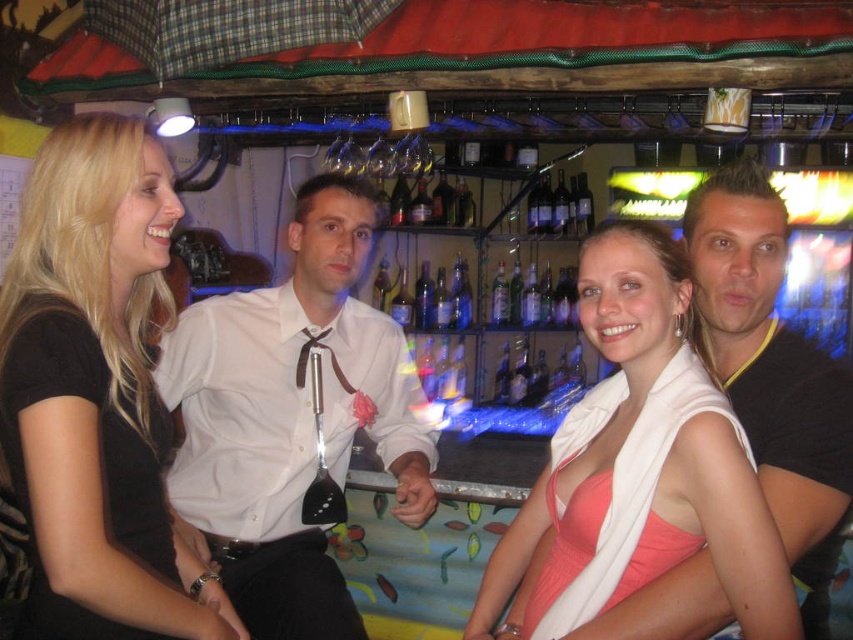
Which is in front, point (630, 394) or point (563, 209)?

Point (630, 394)

Can you confirm if pink satin dress at center is positioned above translucent glass bottles at center?

No.

Describe the element at coordinates (647, 449) in the screenshot. This screenshot has width=853, height=640. I see `pink satin dress at center` at that location.

Find the location of a particular element. This screenshot has width=853, height=640. pink satin dress at center is located at coordinates (647, 449).

Does pink satin dress at center appear on the right side of slick black hair at right?

No, pink satin dress at center is not to the right of slick black hair at right.

In order to click on pink satin dress at center in this screenshot , I will do `click(647, 449)`.

At what (x,y) coordinates should I click in order to perform the action: click on pink satin dress at center. Please return your answer as a coordinate pair (x, y). Looking at the image, I should click on (647, 449).

Is black matte shirt at left positioned in front of translucent glass bottles at center?

Yes, black matte shirt at left is closer to the viewer.

Does black matte shirt at left come behind translucent glass bottles at center?

That is False.

Is point (68, 193) closer to camera compared to point (579, 209)?

Yes, point (68, 193) is in front of point (579, 209).

Find the location of a particular element. black matte shirt at left is located at coordinates (97, 392).